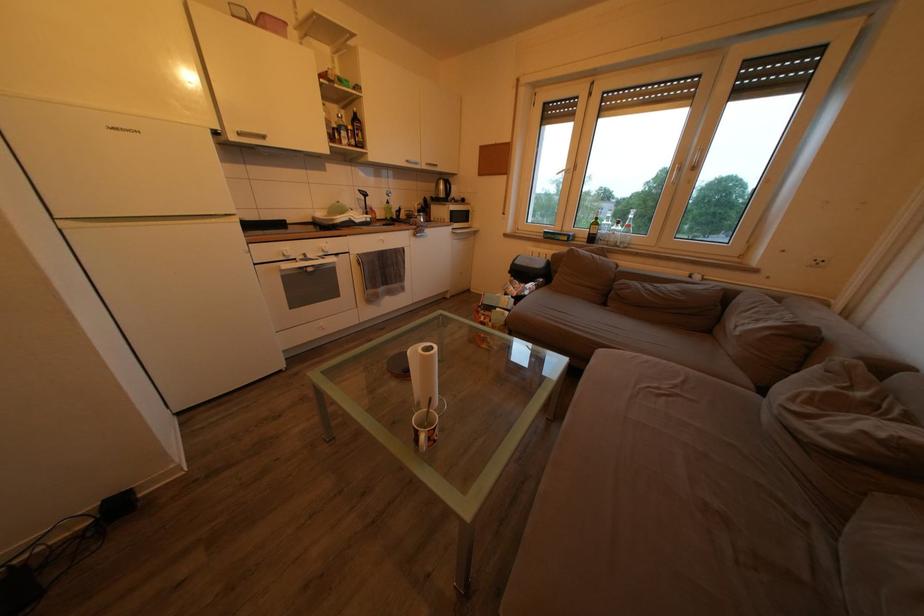
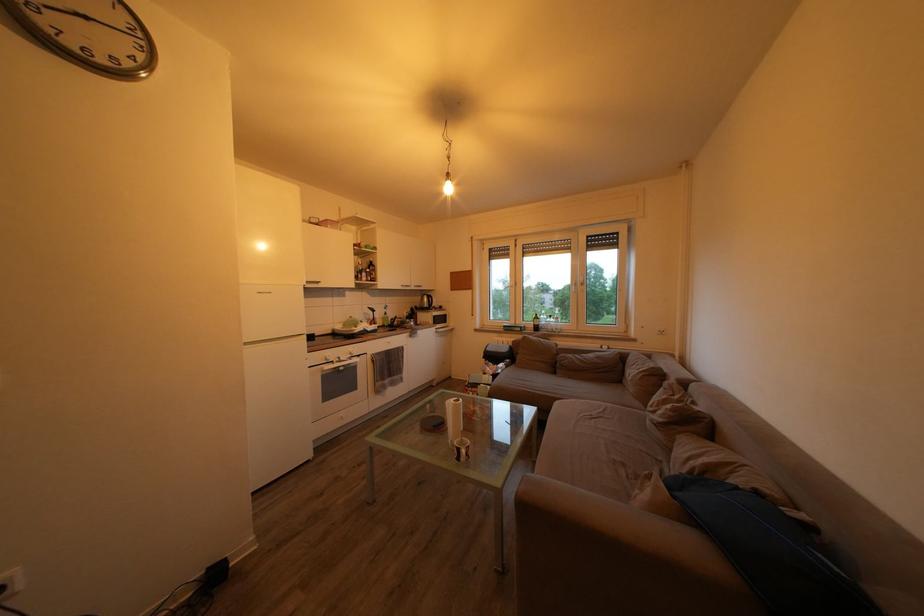
The point at (318,262) is marked in the first image. Where is the corresponding point in the second image?

(349, 363)